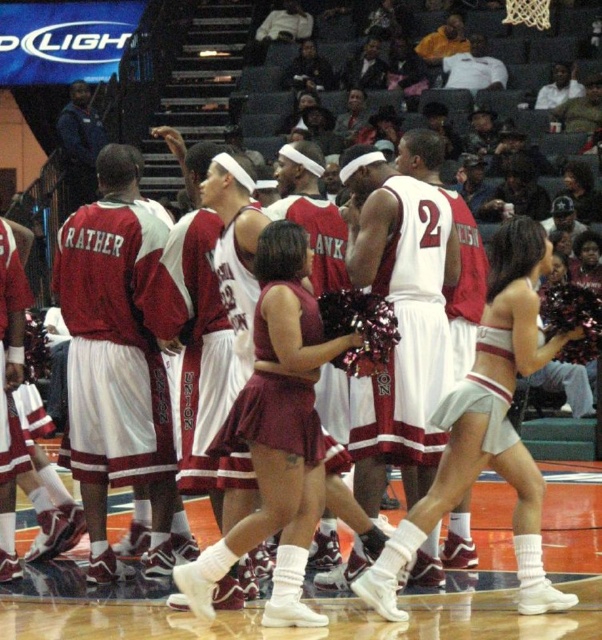
You are a photographer positioned at the center of the basketball court. You notice two points marked in the image. Which point, point (146, 230) or point (424, 342), is closer to your current position?

Point (146, 230) is further to the viewer than point (424, 342), so the closer point to your position would be point (146, 230).

You are a photographer trying to capture a photo of the maroon jersey at center and the white jersey at center during the basketball team huddle. Based on their positions, which jersey should you focus on first to ensure both are in frame?

The maroon jersey at center is located below the white jersey at center, so you should focus on the white jersey at center first to ensure both are in frame.